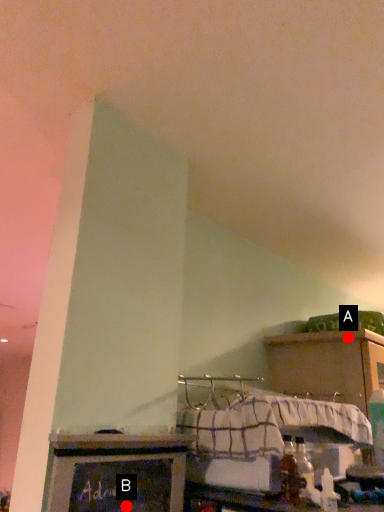
Question: Two points are circled on the image, labeled by A and B beside each circle. Which point appears closest to the camera in this image?

Choices:
 (A) A is closer
 (B) B is closer

Answer: (B)